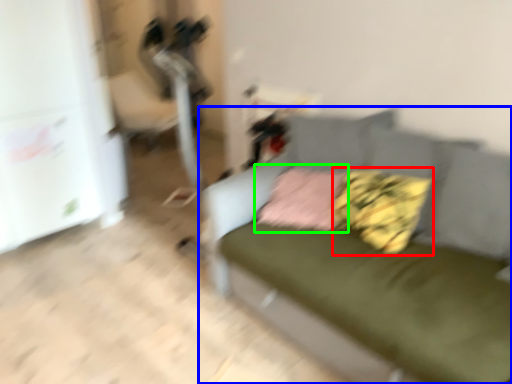
Question: Estimate the real-world distances between objects in this image. Which object is farther from pillow (highlighted by a red box), studio couch (highlighted by a blue box) or pillow (highlighted by a green box)?

Choices:
 (A) studio couch
 (B) pillow

Answer: (A)